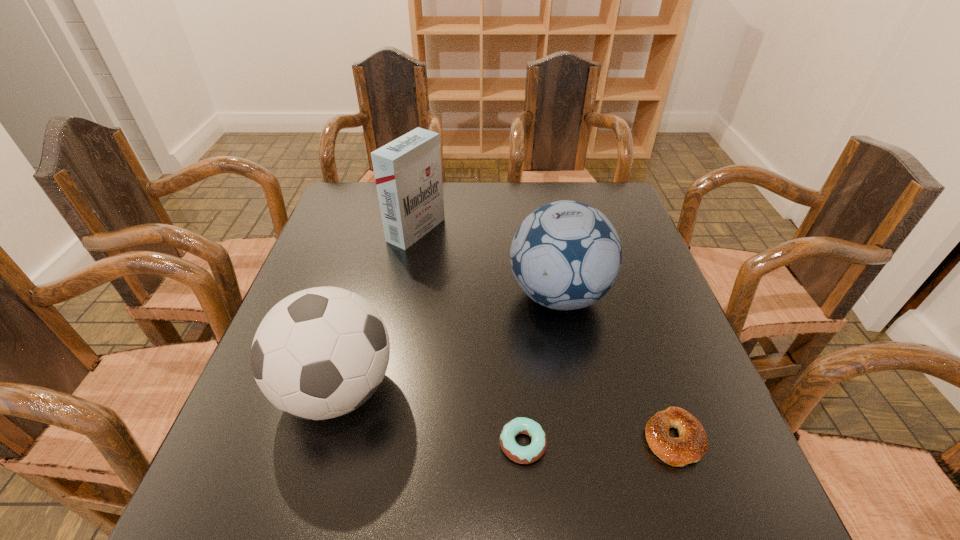
This screenshot has height=540, width=960. Identify the location of vacant space at the near left corner. tap(220, 509).

Find the location of a particular element. The height and width of the screenshot is (540, 960). unoccupied area between the farther soccer ball and the farthest object is located at coordinates (488, 262).

The height and width of the screenshot is (540, 960). I want to click on free space between the fourth nearest object and the second shortest object, so click(616, 367).

In order to click on free space that is in between the shortest object and the left soccer ball in this screenshot , I will do `click(430, 417)`.

Image resolution: width=960 pixels, height=540 pixels. Identify the location of vacant space that's between the doughnut and the cigarette case. (469, 337).

Identify the location of free space between the doughnut and the second shortest object. (598, 441).

At what (x,y) coordinates should I click in order to perform the action: click on vacant space that's between the bagel and the doughnut. Please return your answer as a coordinate pair (x, y). The width and height of the screenshot is (960, 540). Looking at the image, I should click on (598, 441).

The image size is (960, 540). Find the location of `free space between the bagel and the nearer soccer ball`. free space between the bagel and the nearer soccer ball is located at coordinates (506, 414).

The height and width of the screenshot is (540, 960). In order to click on free spot between the second farthest object and the doughnut in this screenshot , I will do `click(540, 369)`.

Where is `free space between the fourth tallest object and the left soccer ball`? free space between the fourth tallest object and the left soccer ball is located at coordinates (506, 414).